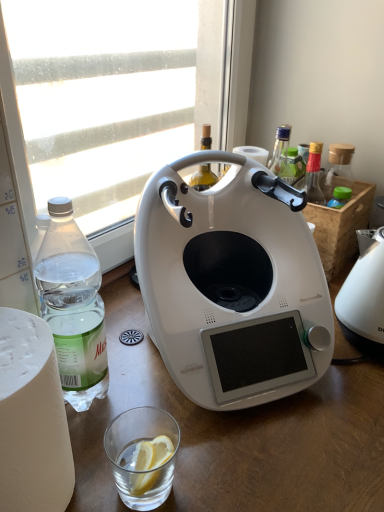
Measure the distance between point [92,134] and camera.

The depth of point [92,134] is 36.65 inches.

This screenshot has width=384, height=512. Describe the element at coordinates (133, 452) in the screenshot. I see `clear glass at lower center` at that location.

Describe the element at coordinates (232, 285) in the screenshot. This screenshot has height=512, width=384. I see `white glossy coffee maker at center, which is the second kitchen appliance in right-to-left order` at that location.

This screenshot has height=512, width=384. What do you see at coordinates (364, 295) in the screenshot?
I see `white plastic kettle at right, placed as the 2th kitchen appliance when sorted from left to right` at bounding box center [364, 295].

Where is `clear plastic bottle at left`? clear plastic bottle at left is located at coordinates (73, 306).

Based on the photo, which object is closer to the camera, clear glass at lower center or clear plastic bottle at left?

clear plastic bottle at left is more forward.

Does clear glass at lower center contain clear plastic bottle at left?

No, clear plastic bottle at left is not a part of clear glass at lower center.

Is point (155, 479) less distant than point (46, 305)?

Yes, point (155, 479) is in front of point (46, 305).

Which object is closer to the camera taking this photo, clear plastic bottle at left or clear glass at lower center?

clear plastic bottle at left is more forward.

Does clear plastic bottle at left have a lesser width compared to clear glass at lower center?

No.

Is clear plastic bottle at left aimed at clear glass at lower center?

Yes, clear plastic bottle at left is aimed at clear glass at lower center.

Considering the relative positions of white glossy coffee maker at center, which is the second kitchen appliance in right-to-left order, and white plastic kettle at right, the first kitchen appliance positioned from the right, in the image provided, is white glossy coffee maker at center, which is the second kitchen appliance in right-to-left order, to the right of white plastic kettle at right, the first kitchen appliance positioned from the right, from the viewer's perspective?

In fact, white glossy coffee maker at center, which is the second kitchen appliance in right-to-left order, is to the left of white plastic kettle at right, the first kitchen appliance positioned from the right.

From the image's perspective, which one is positioned lower, white glossy coffee maker at center, which is the second kitchen appliance in right-to-left order, or white plastic kettle at right, the first kitchen appliance positioned from the right?

white plastic kettle at right, the first kitchen appliance positioned from the right, is shown below in the image.

From a real-world perspective, is white glossy coffee maker at center, which is the second kitchen appliance in right-to-left order, positioned above or below white plastic kettle at right, placed as the 2th kitchen appliance when sorted from left to right?

In terms of real-world spatial position, white glossy coffee maker at center, which is the second kitchen appliance in right-to-left order, is above white plastic kettle at right, placed as the 2th kitchen appliance when sorted from left to right.

Is white glossy coffee maker at center, which is the second kitchen appliance in right-to-left order, next to white plastic kettle at right, placed as the 2th kitchen appliance when sorted from left to right?

No, white glossy coffee maker at center, which is the second kitchen appliance in right-to-left order, is not with white plastic kettle at right, placed as the 2th kitchen appliance when sorted from left to right.

This screenshot has width=384, height=512. Identify the location of coffee cup below the white glossy coffee maker at center, which is counted as the first kitchen appliance, starting from the left (from the image's perspective). (133, 452).

Is white glossy coffee maker at center, which is the second kitchen appliance in right-to-left order, not near clear glass at lower center?

That's not correct — white glossy coffee maker at center, which is the second kitchen appliance in right-to-left order, is a little close to clear glass at lower center.

How far apart are white glossy coffee maker at center, which is the second kitchen appliance in right-to-left order, and clear glass at lower center?

The distance of white glossy coffee maker at center, which is the second kitchen appliance in right-to-left order, from clear glass at lower center is 9.79 inches.

From the image's perspective, is white glossy coffee maker at center, which is the second kitchen appliance in right-to-left order, above or below clear glass at lower center?

Clearly, from the image's perspective, white glossy coffee maker at center, which is the second kitchen appliance in right-to-left order, is above clear glass at lower center.

Between clear glass at lower center and transparent glass window at upper left, which one has smaller width?

Thinner between the two is clear glass at lower center.

Is clear glass at lower center oriented towards transparent glass window at upper left?

No, clear glass at lower center is not facing towards transparent glass window at upper left.

Are clear glass at lower center and transparent glass window at upper left making contact?

clear glass at lower center and transparent glass window at upper left are clearly separated.

Is clear glass at lower center not within transparent glass window at upper left?

clear glass at lower center lies outside transparent glass window at upper left's area.

Is clear plastic bottle at left surrounded by white glossy coffee maker at center, which is counted as the first kitchen appliance, starting from the left?

No.

What's the angular difference between white glossy coffee maker at center, which is the second kitchen appliance in right-to-left order, and clear plastic bottle at left's facing directions?

26.7 degrees separate the facing orientations of white glossy coffee maker at center, which is the second kitchen appliance in right-to-left order, and clear plastic bottle at left.

Considering the positions of point (325, 324) and point (68, 354), is point (325, 324) closer or farther from the camera than point (68, 354)?

Point (325, 324) is farther from the camera than point (68, 354).

Can you confirm if white plastic kettle at right, placed as the 2th kitchen appliance when sorted from left to right, is thinner than clear plastic bottle at left?

No, white plastic kettle at right, placed as the 2th kitchen appliance when sorted from left to right, is not thinner than clear plastic bottle at left.

Is white plastic kettle at right, placed as the 2th kitchen appliance when sorted from left to right, oriented towards clear plastic bottle at left?

No.

Considering the sizes of objects white plastic kettle at right, placed as the 2th kitchen appliance when sorted from left to right, and clear plastic bottle at left in the image provided, who is smaller, white plastic kettle at right, placed as the 2th kitchen appliance when sorted from left to right, or clear plastic bottle at left?

clear plastic bottle at left is smaller.

Can you confirm if white plastic kettle at right, the first kitchen appliance positioned from the right, is positioned to the left of clear plastic bottle at left?

Incorrect, white plastic kettle at right, the first kitchen appliance positioned from the right, is not on the left side of clear plastic bottle at left.

Find the location of a particular element. Image resolution: width=384 pixels, height=512 pixels. bottle above the clear glass at lower center (from a real-world perspective) is located at coordinates (73, 306).

This screenshot has height=512, width=384. Find the location of `bottle on the left of the clear glass at lower center`. bottle on the left of the clear glass at lower center is located at coordinates (73, 306).

Looking at the image, which one is located closer to clear glass at lower center, clear plastic bottle at left or white plastic kettle at right, placed as the 2th kitchen appliance when sorted from left to right?

clear plastic bottle at left lies closer to clear glass at lower center than the other object.

Based on their spatial positions, is clear plastic bottle at left or white glossy coffee maker at center, which is the second kitchen appliance in right-to-left order, closer to transparent glass window at upper left?

Among the two, white glossy coffee maker at center, which is the second kitchen appliance in right-to-left order, is located nearer to transparent glass window at upper left.

Looking at the image, which one is located further to transparent glass window at upper left, white plastic kettle at right, placed as the 2th kitchen appliance when sorted from left to right, or white glossy coffee maker at center, which is counted as the first kitchen appliance, starting from the left?

Based on the image, white plastic kettle at right, placed as the 2th kitchen appliance when sorted from left to right, appears to be further to transparent glass window at upper left.

Looking at the image, which one is located further to white plastic kettle at right, placed as the 2th kitchen appliance when sorted from left to right, white glossy coffee maker at center, which is counted as the first kitchen appliance, starting from the left, or transparent glass window at upper left?

The object further to white plastic kettle at right, placed as the 2th kitchen appliance when sorted from left to right, is transparent glass window at upper left.

In the scene shown: Considering their positions, is white plastic kettle at right, placed as the 2th kitchen appliance when sorted from left to right, positioned closer to white glossy coffee maker at center, which is the second kitchen appliance in right-to-left order, than clear plastic bottle at left?

Among the two, clear plastic bottle at left is located nearer to white glossy coffee maker at center, which is the second kitchen appliance in right-to-left order.

When comparing their distances from transparent glass window at upper left, does clear glass at lower center or white plastic kettle at right, placed as the 2th kitchen appliance when sorted from left to right, seem closer?

white plastic kettle at right, placed as the 2th kitchen appliance when sorted from left to right, is positioned closer to the anchor transparent glass window at upper left.

From the image, which object appears to be farther from white glossy coffee maker at center, which is counted as the first kitchen appliance, starting from the left, white plastic kettle at right, placed as the 2th kitchen appliance when sorted from left to right, or transparent glass window at upper left?

transparent glass window at upper left is further to white glossy coffee maker at center, which is counted as the first kitchen appliance, starting from the left.

From the image, which object appears to be nearer to transparent glass window at upper left, clear plastic bottle at left or clear glass at lower center?

clear plastic bottle at left.

Find the location of a particular element. kitchen appliance located between transparent glass window at upper left and white plastic kettle at right, the first kitchen appliance positioned from the right, in the left-right direction is located at coordinates (232, 285).

Locate an element on the screen. The height and width of the screenshot is (512, 384). kitchen appliance between transparent glass window at upper left and clear plastic bottle at left vertically is located at coordinates (232, 285).

Locate an element on the screen. This screenshot has width=384, height=512. coffee cup between clear plastic bottle at left and white plastic kettle at right, the first kitchen appliance positioned from the right is located at coordinates (133, 452).

This screenshot has width=384, height=512. I want to click on bottle that lies between white glossy coffee maker at center, which is the second kitchen appliance in right-to-left order, and clear glass at lower center from top to bottom, so click(x=73, y=306).